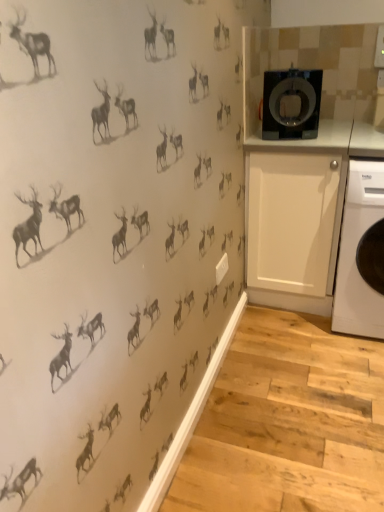
This screenshot has width=384, height=512. What are the coordinates of `vacant space in front of black glossy washing machine at upper right` in the screenshot? It's located at (303, 143).